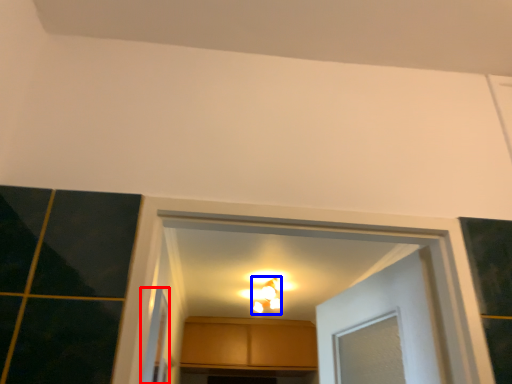
Question: Which point is further to the camera, screen door (highlighted by a red box) or light fixture (highlighted by a blue box)?

Choices:
 (A) screen door
 (B) light fixture

Answer: (B)